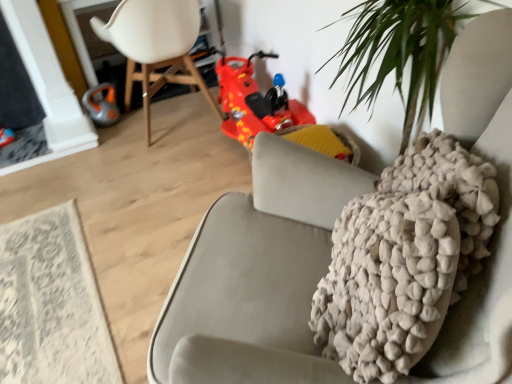
Locate an element on the screen. Image resolution: width=512 pixels, height=384 pixels. free space between orange rubber vacuum cleaner at left and white plastic chair at upper left is located at coordinates (129, 136).